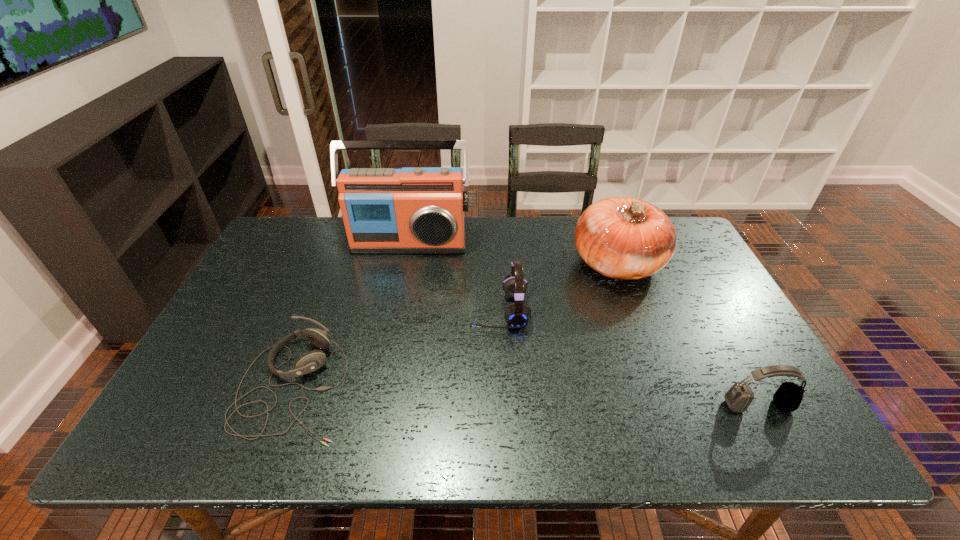
At what (x,y) coordinates should I click in order to perform the action: click on the tallest object. Please return your answer as a coordinate pair (x, y). Looking at the image, I should click on (420, 210).

Find the location of a particular element. The image size is (960, 540). the fourth shortest object is located at coordinates (624, 238).

Locate an element on the screen. the second headset from right to left is located at coordinates (517, 314).

Find the location of a particular element. the farthest headset is located at coordinates (517, 314).

The image size is (960, 540). What are the coordinates of `the second shortest headset` in the screenshot? It's located at (788, 397).

Where is `the rightmost headset`? The height and width of the screenshot is (540, 960). the rightmost headset is located at coordinates (788, 397).

Find the location of a particular element. the shortest object is located at coordinates (311, 361).

Image resolution: width=960 pixels, height=540 pixels. In order to click on the leftmost headset in this screenshot , I will do point(311,361).

Find the location of a particular element. vacant position located 0.180m on the front-facing side of the tallest object is located at coordinates (398, 295).

Where is `blank area located on the front of the second tallest object`? The width and height of the screenshot is (960, 540). blank area located on the front of the second tallest object is located at coordinates tap(642, 328).